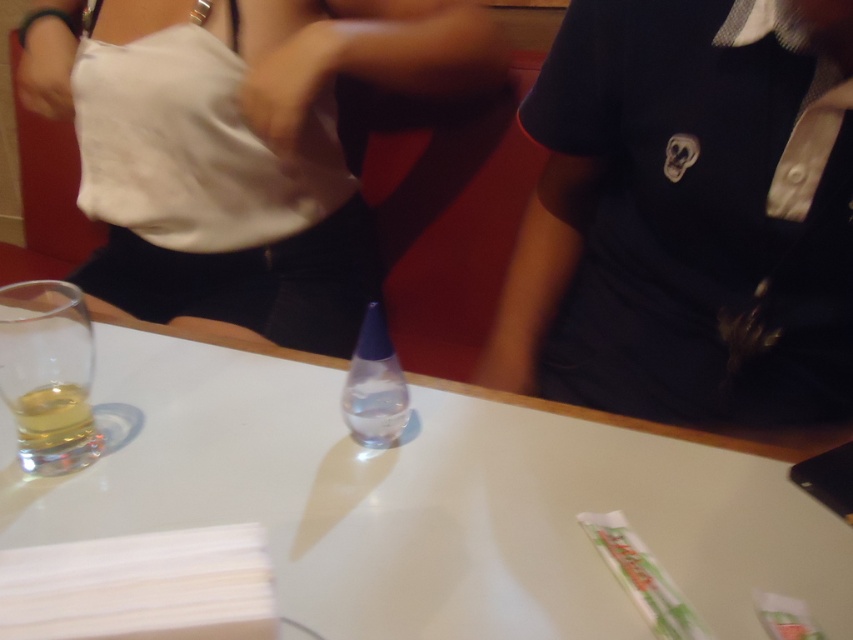
Can you confirm if navy blue polo shirt at upper right is positioned to the right of translucent glass at left?

Indeed, navy blue polo shirt at upper right is positioned on the right side of translucent glass at left.

Is navy blue polo shirt at upper right to the left of translucent glass at left from the viewer's perspective?

No, navy blue polo shirt at upper right is not to the left of translucent glass at left.

Identify the location of navy blue polo shirt at upper right. (688, 218).

You are a GUI agent. You are given a task and a screenshot of the screen. Output one action in this format:
    pyautogui.click(x=<x>, y=<y>)
    Task: Click on the navy blue polo shirt at upper right
    This screenshot has height=640, width=853.
    Given the screenshot: What is the action you would take?
    pyautogui.click(x=688, y=218)

Who is positioned more to the left, navy blue polo shirt at upper right or white matte tank top at upper left?

Positioned to the left is white matte tank top at upper left.

Between point (664, 410) and point (276, 65), which one is positioned behind?

The point (276, 65) is more distant.

Image resolution: width=853 pixels, height=640 pixels. Identify the location of navy blue polo shirt at upper right. (688, 218).

Which is above, white glossy table at center or transparent plastic bottle at center?

transparent plastic bottle at center is above.

Identify the location of white glossy table at center. (426, 500).